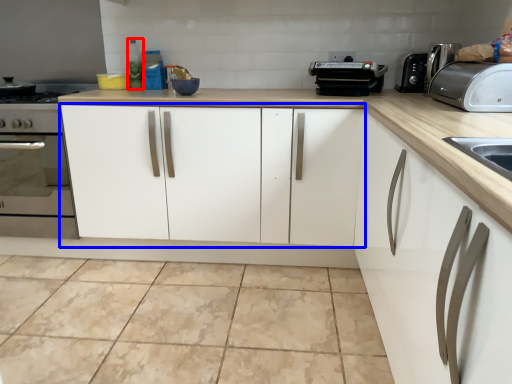
Question: Which of the following is the closest to the observer, bottle (highlighted by a red box) or cabinetry (highlighted by a blue box)?

Choices:
 (A) bottle
 (B) cabinetry

Answer: (B)